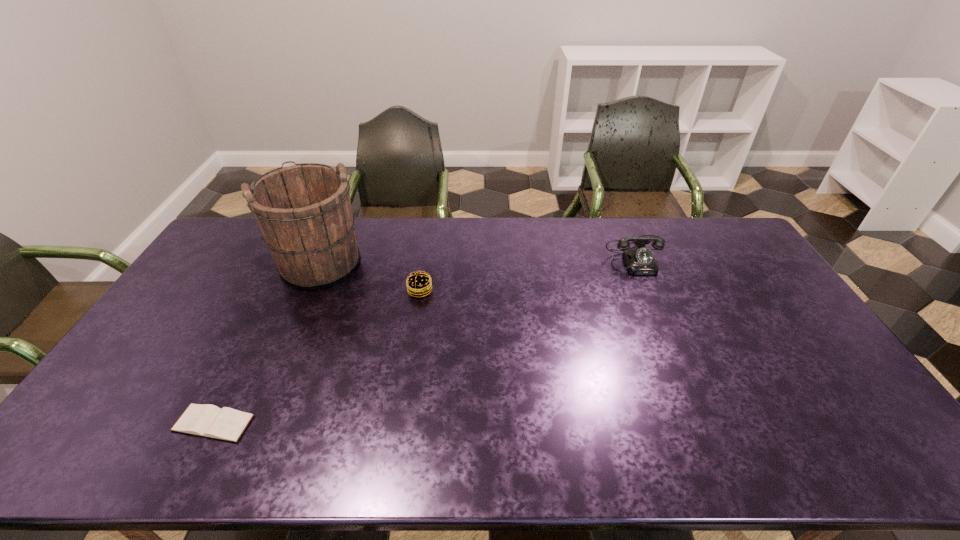
The image size is (960, 540). In order to click on free space that satisfies the following two spatial constraints: 1. on the back side of the diary; 2. on the left side of the bucket in this screenshot , I will do `click(295, 261)`.